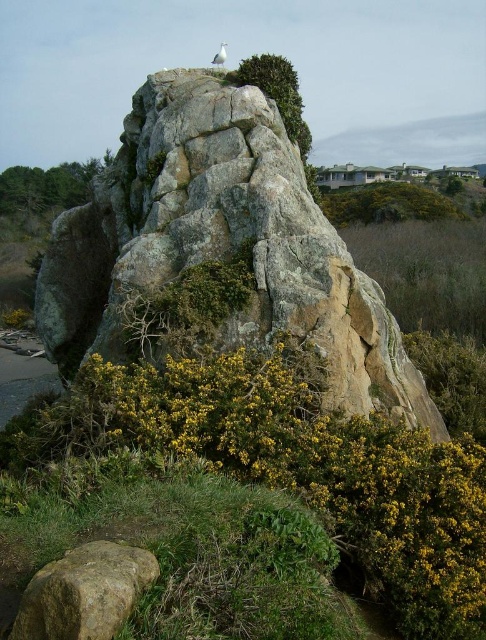
Does rough textured rock at center have a smaller size compared to white glossy bird at upper center?

Yes.

Does rough textured rock at center have a greater width compared to white glossy bird at upper center?

In fact, rough textured rock at center might be narrower than white glossy bird at upper center.

The height and width of the screenshot is (640, 486). I want to click on rough textured rock at center, so click(222, 244).

Does point (28, 196) lie in front of point (293, 104)?

No, it is not.

What do you see at coordinates (48, 186) in the screenshot?
I see `green leafy tree at left` at bounding box center [48, 186].

What do you see at coordinates (48, 186) in the screenshot? I see `green leafy tree at left` at bounding box center [48, 186].

In order to click on green leafy tree at left in this screenshot , I will do `click(48, 186)`.

The image size is (486, 640). Describe the element at coordinates (222, 244) in the screenshot. I see `rough textured rock at center` at that location.

The image size is (486, 640). Describe the element at coordinates (222, 244) in the screenshot. I see `rough textured rock at center` at that location.

This screenshot has width=486, height=640. I want to click on rough textured rock at center, so click(x=222, y=244).